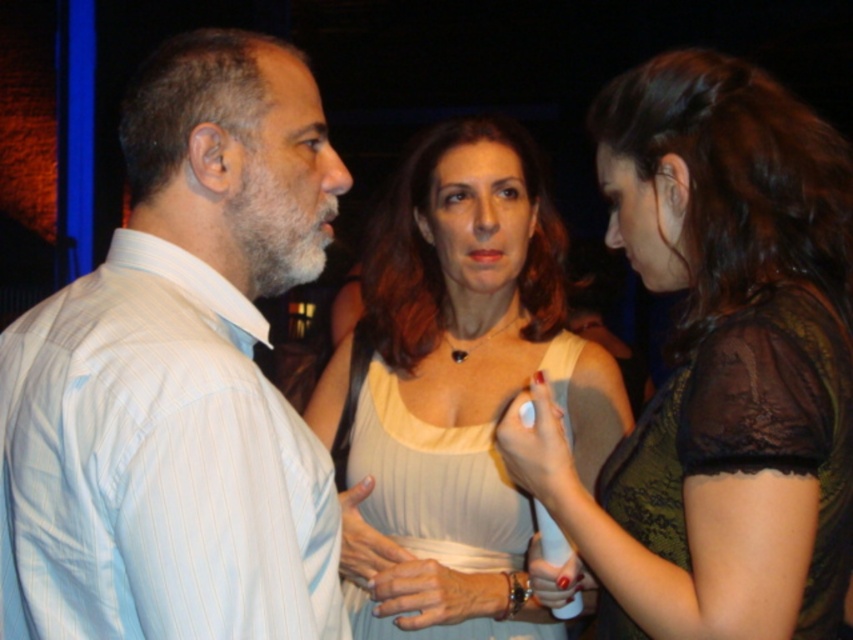
You are a photographer setting up for a group photo. You need to position a spotlight so that it illuminates both the white striped shirt at left and the white ribbed fabric dress at center without causing glare on any glasses someone might be wearing. Considering their positions, which object should be placed higher to avoid glare?

The white striped shirt at left is above the white ribbed fabric dress at center. To avoid glare on glasses, the spotlight should be angled so that it illuminates the higher positioned white striped shirt at left first, then the lower positioned white ribbed fabric dress at center.

You are standing in the room and want to hand a gift to the woman wearing the matte white dress at center. Based on the coordinates provided in the Objects Description, in which direction should you move to approach her?

The matte white dress at center is located at point coordinates, so you should move towards the center of the room to reach her.